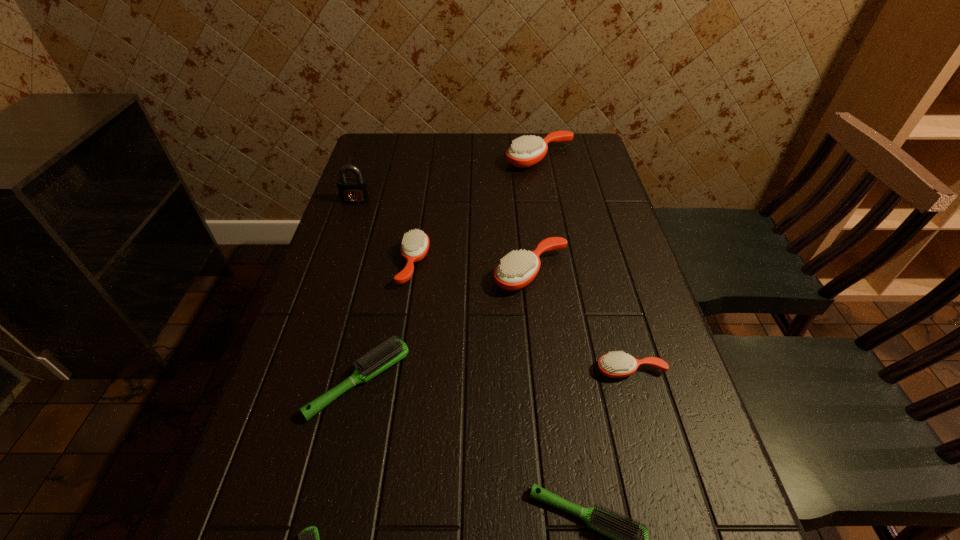
This screenshot has width=960, height=540. Identify the location of the sixth closest hairbrush relative to the smallest orange hairbrush. (526, 151).

At what (x,y) coordinates should I click in order to perform the action: click on orange hairbrush that stands as the closest to the biggest orange hairbrush. Please return your answer as a coordinate pair (x, y). Looking at the image, I should click on (516, 270).

Find the location of a particular element. the closest orange hairbrush to the nearest orange hairbrush is located at coordinates (516, 270).

Identify which light hairbrush is the closest to the second smallest light hairbrush. Please provide its 2D coordinates. Your answer should be formatted as a tuple, i.e. [(x, y)], where the tuple contains the x and y coordinates of a point satisfying the conditions above.

[(375, 362)]

Locate an element on the screen. The image size is (960, 540). light hairbrush that is the second closest to the third tallest hairbrush is located at coordinates (629, 539).

Where is `blank area in the image that satisfies the following two spatial constraints: 1. on the front side of the nearest orange hairbrush; 2. on the left side of the fourth tallest object`? This screenshot has width=960, height=540. blank area in the image that satisfies the following two spatial constraints: 1. on the front side of the nearest orange hairbrush; 2. on the left side of the fourth tallest object is located at coordinates (397, 370).

The image size is (960, 540). I want to click on vacant area in the image that satisfies the following two spatial constraints: 1. on the front of the seventh nearest object near the keyhole; 2. on the right side of the nearest orange hairbrush, so click(299, 370).

Where is `free space that satisfies the following two spatial constraints: 1. on the front of the tallest object near the keyhole; 2. on the right side of the nearest orange hairbrush`? The width and height of the screenshot is (960, 540). free space that satisfies the following two spatial constraints: 1. on the front of the tallest object near the keyhole; 2. on the right side of the nearest orange hairbrush is located at coordinates (299, 370).